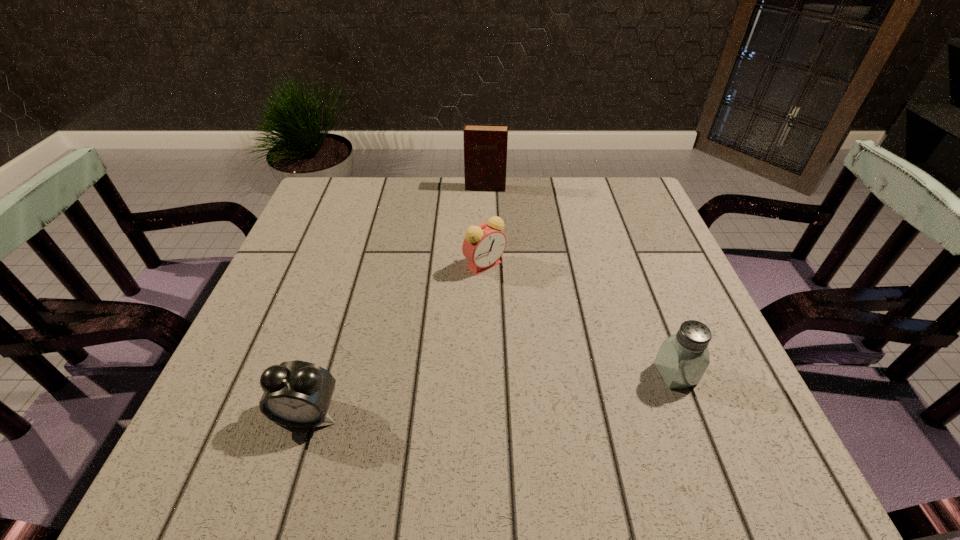
This screenshot has width=960, height=540. What are the coordinates of `vacant space on the desktop that is between the nearer alarm clock and the saltshaker and is positioned on the face of the right alarm clock` in the screenshot? It's located at (476, 395).

Find the location of a particular element. The height and width of the screenshot is (540, 960). free space on the desktop that is between the leftmost object and the saltshaker and is positioned on the front cover of the diary is located at coordinates (463, 397).